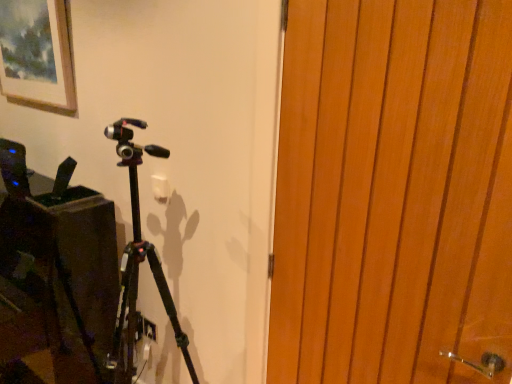
Question: Are matte wooden picture frame at upper left and black matte tripod at center far apart?

Choices:
 (A) yes
 (B) no

Answer: (B)

Question: From the image's perspective, is matte wooden picture frame at upper left on top of black matte tripod at center?

Choices:
 (A) no
 (B) yes

Answer: (B)

Question: Considering the relative sizes of matte wooden picture frame at upper left and black matte tripod at center in the image provided, is matte wooden picture frame at upper left smaller than black matte tripod at center?

Choices:
 (A) no
 (B) yes

Answer: (B)

Question: Can you confirm if matte wooden picture frame at upper left is shorter than black matte tripod at center?

Choices:
 (A) no
 (B) yes

Answer: (B)

Question: Can you confirm if matte wooden picture frame at upper left is positioned to the left of black matte tripod at center?

Choices:
 (A) yes
 (B) no

Answer: (A)

Question: Does matte wooden picture frame at upper left have a larger size compared to black matte tripod at center?

Choices:
 (A) no
 (B) yes

Answer: (A)

Question: Considering the relative sizes of black matte tripod at center and matte wooden picture frame at upper left in the image provided, is black matte tripod at center taller than matte wooden picture frame at upper left?

Choices:
 (A) yes
 (B) no

Answer: (A)

Question: Is black matte tripod at center closer to the viewer compared to matte wooden picture frame at upper left?

Choices:
 (A) no
 (B) yes

Answer: (B)

Question: Is black matte tripod at center positioned with its back to matte wooden picture frame at upper left?

Choices:
 (A) yes
 (B) no

Answer: (B)

Question: Is the surface of black matte tripod at center in direct contact with matte wooden picture frame at upper left?

Choices:
 (A) yes
 (B) no

Answer: (B)

Question: Does black matte tripod at center appear on the left side of matte wooden picture frame at upper left?

Choices:
 (A) no
 (B) yes

Answer: (A)

Question: Is black matte tripod at center facing towards matte wooden picture frame at upper left?

Choices:
 (A) yes
 (B) no

Answer: (B)

Question: Considering the relative sizes of wooden door at right and black matte tripod at center in the image provided, is wooden door at right smaller than black matte tripod at center?

Choices:
 (A) no
 (B) yes

Answer: (B)